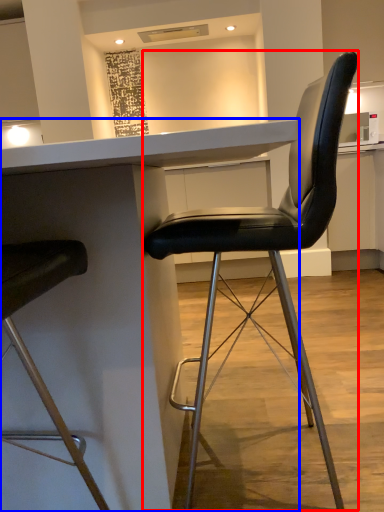
Question: Among these objects, which one is nearest to the camera, chair (highlighted by a red box) or table (highlighted by a blue box)?

Choices:
 (A) chair
 (B) table

Answer: (B)